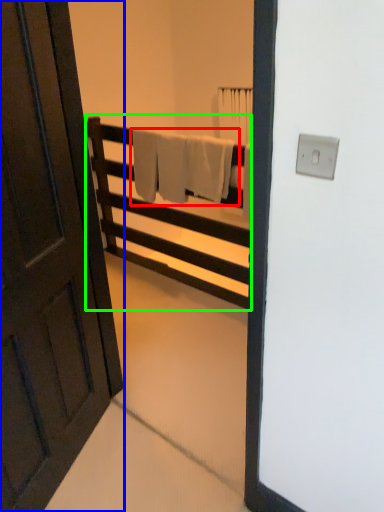
Question: Which object is positioned farthest from bath towel (highlighted by a red box)? Select from door (highlighted by a blue box) and furniture (highlighted by a green box).

Choices:
 (A) door
 (B) furniture

Answer: (A)